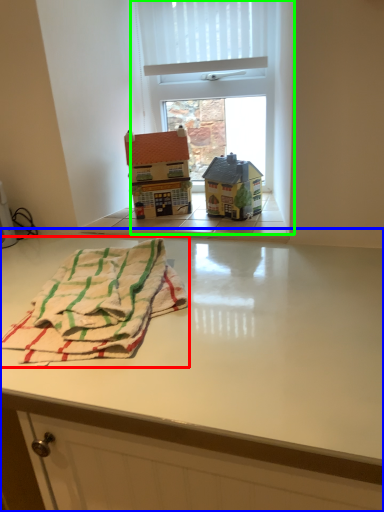
Question: Which object is positioned farthest from beach towel (highlighted by a red box)? Select from table (highlighted by a blue box) and window (highlighted by a green box).

Choices:
 (A) table
 (B) window

Answer: (B)